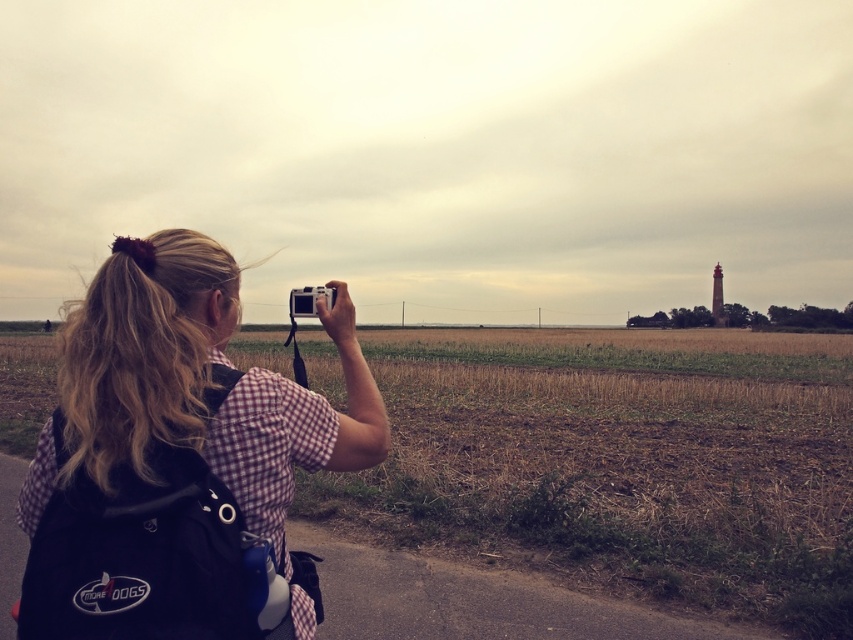
Is point (608, 417) behind point (308, 307)?

That is True.

Which is in front, point (675, 536) or point (289, 300)?

Positioned in front is point (289, 300).

Is point (506, 371) farther from camera compared to point (306, 308)?

Yes.

Image resolution: width=853 pixels, height=640 pixels. I want to click on brown grass at center, so click(624, 460).

Between checkered fabric shirt at center and silver metallic camera at upper center, which one is positioned lower?

checkered fabric shirt at center is below.

Can you confirm if checkered fabric shirt at center is shorter than silver metallic camera at upper center?

In fact, checkered fabric shirt at center may be taller than silver metallic camera at upper center.

In order to click on checkered fabric shirt at center in this screenshot , I will do `click(178, 460)`.

In the scene shown: Does brown grass at center have a lesser width compared to checkered fabric shirt at center?

No.

Is point (653, 538) behind point (126, 589)?

Yes, it is.

The image size is (853, 640). In order to click on brown grass at center in this screenshot , I will do `click(624, 460)`.